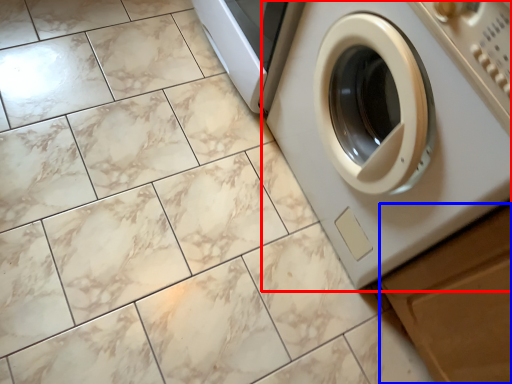
Question: Which object is closer to the camera taking this photo, washing machine (highlighted by a red box) or drawer (highlighted by a blue box)?

Choices:
 (A) washing machine
 (B) drawer

Answer: (A)